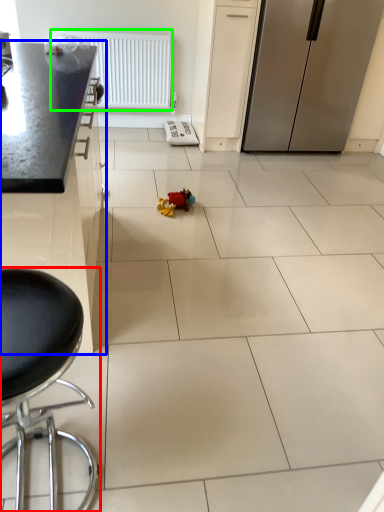
Question: Estimate the real-world distances between objects in this image. Which object is closer to chair (highlighted by a red box), cabinetry (highlighted by a blue box) or radiator (highlighted by a green box)?

Choices:
 (A) cabinetry
 (B) radiator

Answer: (A)